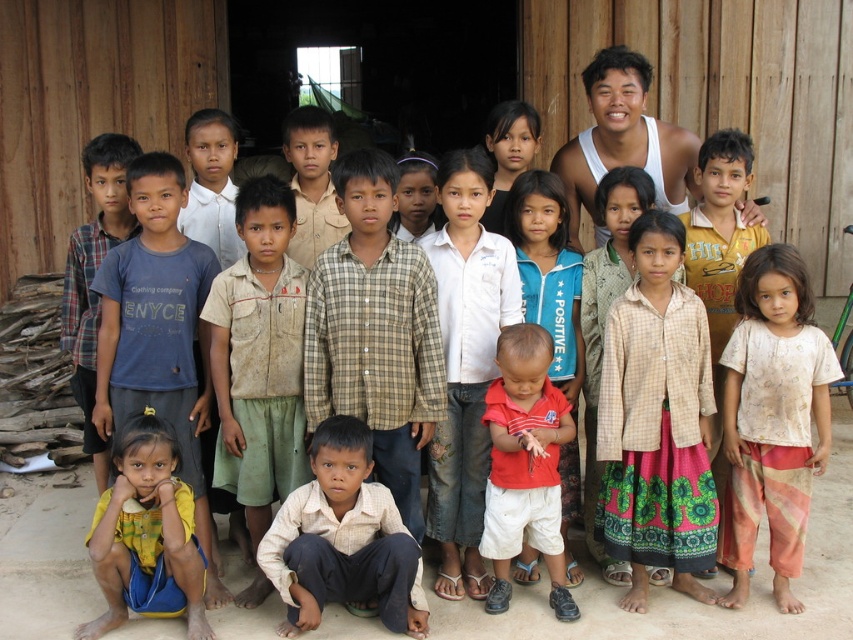
You are a photographer trying to capture a photo of the checkered fabric shirt at center and the yellow fabric at lower left. Since you want both in focus, you need to know their positions. Which object is located to the right of the other?

The checkered fabric shirt at center is positioned on the right side of yellow fabric at lower left.

You are a photographer trying to capture a group shot of the children and the adult standing outdoors. You notice the light beige printed shirt at lower right. Where is the light beige printed shirt located in relation to the other objects in the scene?

The light beige printed shirt at lower right is located at point 0.655 on the horizontal axis and 0.906 on the vertical axis within the scene.

What is located at the coordinates point [656,420]?

The checkered fabric shirt at center is located at point [656,420].